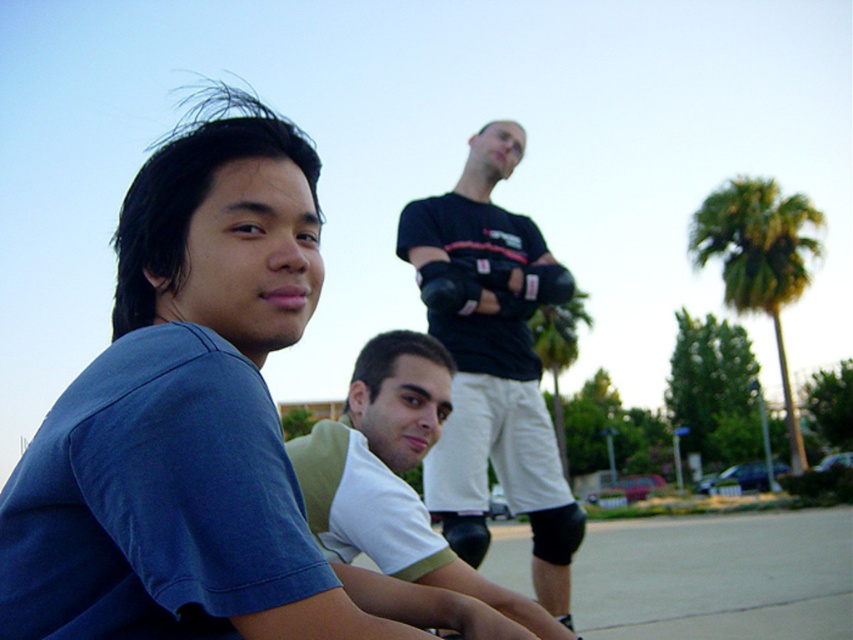
Who is lower down, white jersey at center or green leafy palm tree at center-right?

green leafy palm tree at center-right is below.

This screenshot has width=853, height=640. I want to click on white jersey at center, so click(x=393, y=476).

Is blue cotton shirt at upper left positioned behind black matte t-shirt at center?

No, it is not.

Can you confirm if blue cotton shirt at upper left is shorter than black matte t-shirt at center?

Yes, blue cotton shirt at upper left is shorter than black matte t-shirt at center.

Does point (50, 456) lie in front of point (457, 340)?

That is True.

Locate an element on the screen. blue cotton shirt at upper left is located at coordinates (183, 416).

Is point (517, 237) closer to camera compared to point (553, 307)?

Yes, point (517, 237) is in front of point (553, 307).

Between black matte t-shirt at center and green leafy palm tree at center-right, which one appears on the right side from the viewer's perspective?

green leafy palm tree at center-right

Between point (425, 259) and point (573, 342), which one is positioned in front?

Point (425, 259)

Where is `black matte t-shirt at center`? This screenshot has height=640, width=853. black matte t-shirt at center is located at coordinates (492, 364).